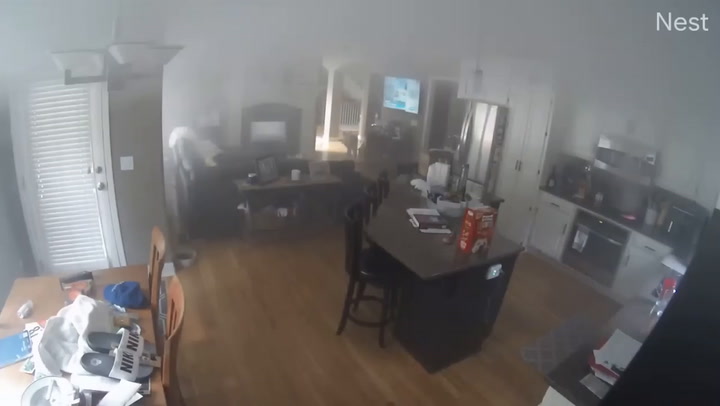
The width and height of the screenshot is (720, 406). I want to click on clutter, so click(76, 343).